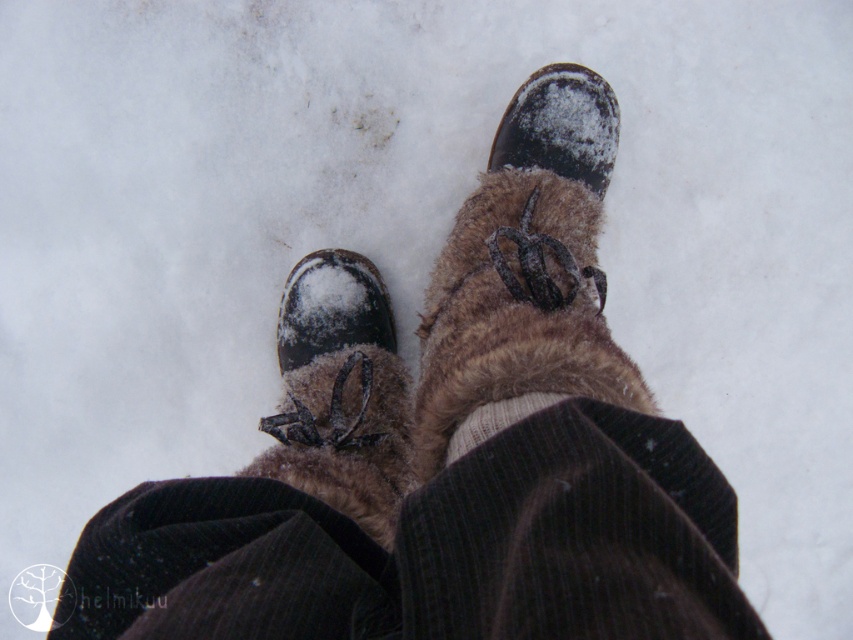
You are a photographer trying to capture the texture of the snow and the fur on the boots. You notice that the brown fuzzy boot at center is represented by point (526, 269). What is the coordinate of the brown fuzzy boot at center?

The brown fuzzy boot at center is represented by point (526, 269).

You are a photographer capturing the scene from above. You need to place two markers at point (561, 161) and point (498, 412). Which marker should you place first if you want to follow the path from the front to the back of the scene?

You should place the marker at point (498, 412) first because it is in front of point (561, 161), so following the path from front to back would start with the closer point.

From the picture: You are trying to determine which item is bigger between the fuzzy brown boot at center and the white knitted sock at center. Based on the scene description, which one is larger?

The fuzzy brown boot at center has a larger size compared to the white knitted sock at center, so the fuzzy brown boot at center is bigger.